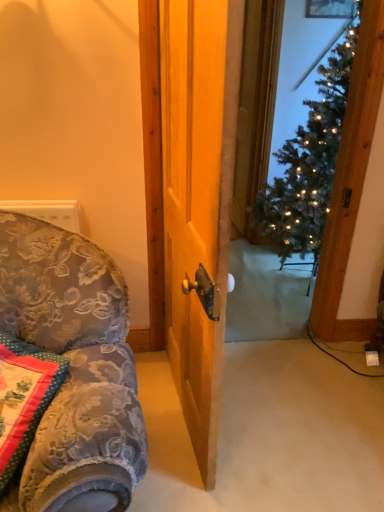
Describe the element at coordinates (309, 161) in the screenshot. I see `iridescent metallic christmas tree at center` at that location.

In order to face iridescent metallic christmas tree at center, should I rotate leftwards or rightwards?

You should look right and rotate roughly 15.781 degrees.

This screenshot has height=512, width=384. In order to click on iridescent metallic christmas tree at center in this screenshot , I will do `click(309, 161)`.

What is the approximate width of floral fabric pillow at lower left?

It is 14.68 inches.

This screenshot has height=512, width=384. I want to click on floral fabric pillow at lower left, so click(x=23, y=397).

Describe the element at coordinates (23, 397) in the screenshot. I see `floral fabric pillow at lower left` at that location.

Image resolution: width=384 pixels, height=512 pixels. I want to click on iridescent metallic christmas tree at center, so click(x=309, y=161).

Considering the relative positions of iridescent metallic christmas tree at center and floral fabric pillow at lower left in the image provided, is iridescent metallic christmas tree at center to the right of floral fabric pillow at lower left from the viewer's perspective?

Yes.

Is iridescent metallic christmas tree at center closer to camera compared to floral fabric pillow at lower left?

No, iridescent metallic christmas tree at center is further to the viewer.

Between point (311, 174) and point (29, 377), which one is positioned in front?

Point (29, 377)

From the image's perspective, is iridescent metallic christmas tree at center positioned above or below floral fabric pillow at lower left?

Clearly, from the image's perspective, iridescent metallic christmas tree at center is above floral fabric pillow at lower left.

From a real-world perspective, is iridescent metallic christmas tree at center physically above floral fabric pillow at lower left?

Yes, from a real-world perspective, iridescent metallic christmas tree at center is above floral fabric pillow at lower left.

Considering the sizes of objects iridescent metallic christmas tree at center and floral fabric pillow at lower left in the image provided, who is thinner, iridescent metallic christmas tree at center or floral fabric pillow at lower left?

floral fabric pillow at lower left is thinner.

Is iridescent metallic christmas tree at center shorter than floral fabric pillow at lower left?

No, iridescent metallic christmas tree at center is not shorter than floral fabric pillow at lower left.

Considering the sizes of objects iridescent metallic christmas tree at center and floral fabric pillow at lower left in the image provided, who is bigger, iridescent metallic christmas tree at center or floral fabric pillow at lower left?

iridescent metallic christmas tree at center is bigger.

Is iridescent metallic christmas tree at center not within floral fabric pillow at lower left?

Indeed, iridescent metallic christmas tree at center is completely outside floral fabric pillow at lower left.

Is iridescent metallic christmas tree at center directly adjacent to floral fabric pillow at lower left?

No.

Could you tell me if iridescent metallic christmas tree at center is facing floral fabric pillow at lower left?

No, iridescent metallic christmas tree at center is not oriented towards floral fabric pillow at lower left.

How much distance is there between iridescent metallic christmas tree at center and floral fabric pillow at lower left?

A distance of 1.72 meters exists between iridescent metallic christmas tree at center and floral fabric pillow at lower left.

This screenshot has width=384, height=512. I want to click on pillow on the left of the iridescent metallic christmas tree at center, so click(x=23, y=397).

Considering the positions of objects floral fabric pillow at lower left and iridescent metallic christmas tree at center in the image provided, who is more to the left, floral fabric pillow at lower left or iridescent metallic christmas tree at center?

From the viewer's perspective, floral fabric pillow at lower left appears more on the left side.

Considering the relative positions of floral fabric pillow at lower left and iridescent metallic christmas tree at center in the image provided, is floral fabric pillow at lower left behind iridescent metallic christmas tree at center?

No, the depth of floral fabric pillow at lower left is less than that of iridescent metallic christmas tree at center.

Considering the positions of points (10, 366) and (319, 201), is point (10, 366) closer to camera compared to point (319, 201)?

Yes, point (10, 366) is closer to viewer.

From the image's perspective, who appears lower, floral fabric pillow at lower left or iridescent metallic christmas tree at center?

floral fabric pillow at lower left, from the image's perspective.

From a real-world perspective, who is located lower, floral fabric pillow at lower left or iridescent metallic christmas tree at center?

floral fabric pillow at lower left.

Which of these two, floral fabric pillow at lower left or iridescent metallic christmas tree at center, is wider?

iridescent metallic christmas tree at center.

Is floral fabric pillow at lower left shorter than iridescent metallic christmas tree at center?

Correct, floral fabric pillow at lower left is not as tall as iridescent metallic christmas tree at center.

Is floral fabric pillow at lower left smaller than iridescent metallic christmas tree at center?

Indeed, floral fabric pillow at lower left has a smaller size compared to iridescent metallic christmas tree at center.

Is iridescent metallic christmas tree at center surrounded by floral fabric pillow at lower left?

No, iridescent metallic christmas tree at center is not surrounded by floral fabric pillow at lower left.

Is floral fabric pillow at lower left far from iridescent metallic christmas tree at center?

Yes, floral fabric pillow at lower left and iridescent metallic christmas tree at center are located far from each other.

Could you tell me if floral fabric pillow at lower left is facing iridescent metallic christmas tree at center?

No, floral fabric pillow at lower left is not facing towards iridescent metallic christmas tree at center.

What's the angular difference between floral fabric pillow at lower left and iridescent metallic christmas tree at center's facing directions?

56.2 degrees separate the facing orientations of floral fabric pillow at lower left and iridescent metallic christmas tree at center.

The width and height of the screenshot is (384, 512). Find the location of `pillow below the iridescent metallic christmas tree at center (from the image's perspective)`. pillow below the iridescent metallic christmas tree at center (from the image's perspective) is located at coordinates (23, 397).

Locate an element on the screen. christmas tree that appears behind the floral fabric pillow at lower left is located at coordinates (309, 161).

The width and height of the screenshot is (384, 512). I want to click on pillow below the iridescent metallic christmas tree at center (from a real-world perspective), so click(23, 397).